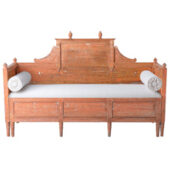
The image size is (170, 170). Find the location of `bench seat`. bench seat is located at coordinates (88, 90).